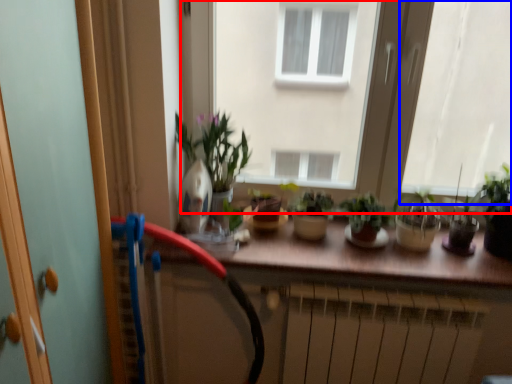
Question: Which point is further to the camera, window (highlighted by a red box) or window (highlighted by a blue box)?

Choices:
 (A) window
 (B) window

Answer: (A)